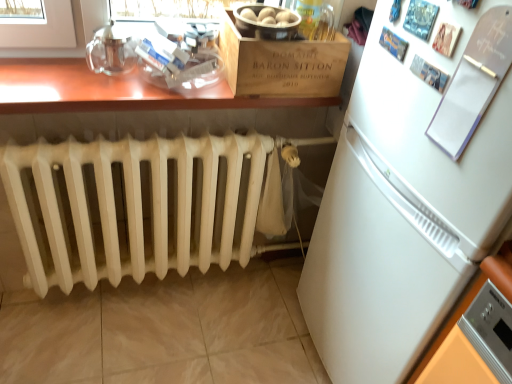
Question: Looking at their shapes, would you say wooden table at upper center is wider or thinner than white paperboard at upper right?

Choices:
 (A) thin
 (B) wide

Answer: (B)

Question: From the image's perspective, is wooden table at upper center positioned above or below white paperboard at upper right?

Choices:
 (A) below
 (B) above

Answer: (B)

Question: Which object is positioned closest to the wooden crate at upper center?

Choices:
 (A) white matte refrigerator at right
 (B) white painted radiator at lower left
 (C) white paperboard at upper right
 (D) wooden table at upper center

Answer: (D)

Question: Which object is positioned farthest from the wooden table at upper center?

Choices:
 (A) white painted radiator at lower left
 (B) white matte refrigerator at right
 (C) white paperboard at upper right
 (D) wooden crate at upper center

Answer: (C)